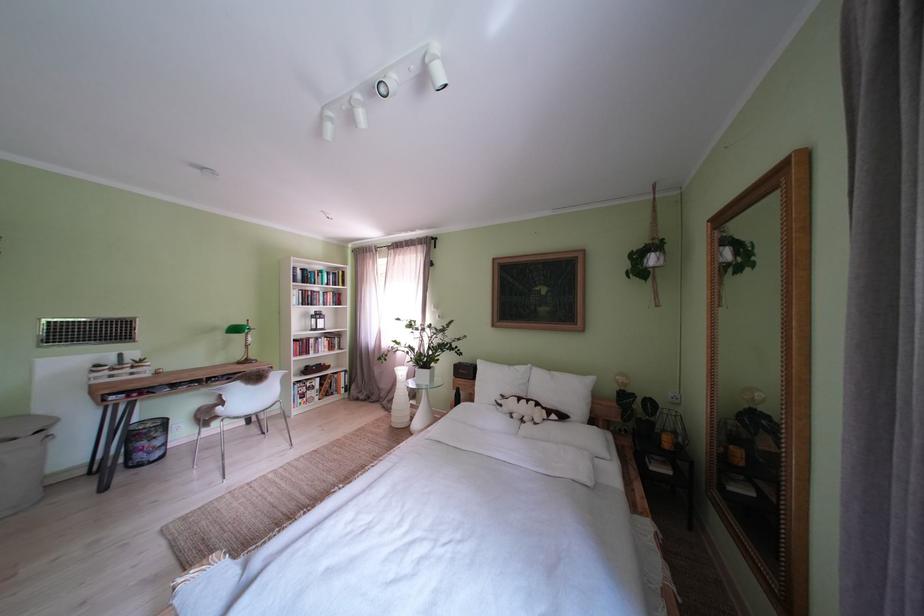
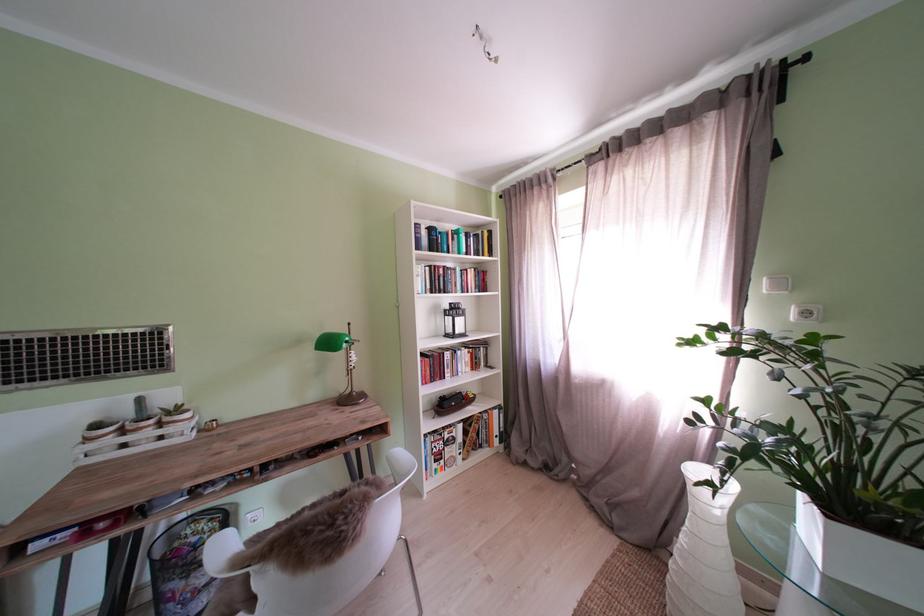
Find the pixel in the second image that matches (x=329, y=392) in the first image.

(470, 444)